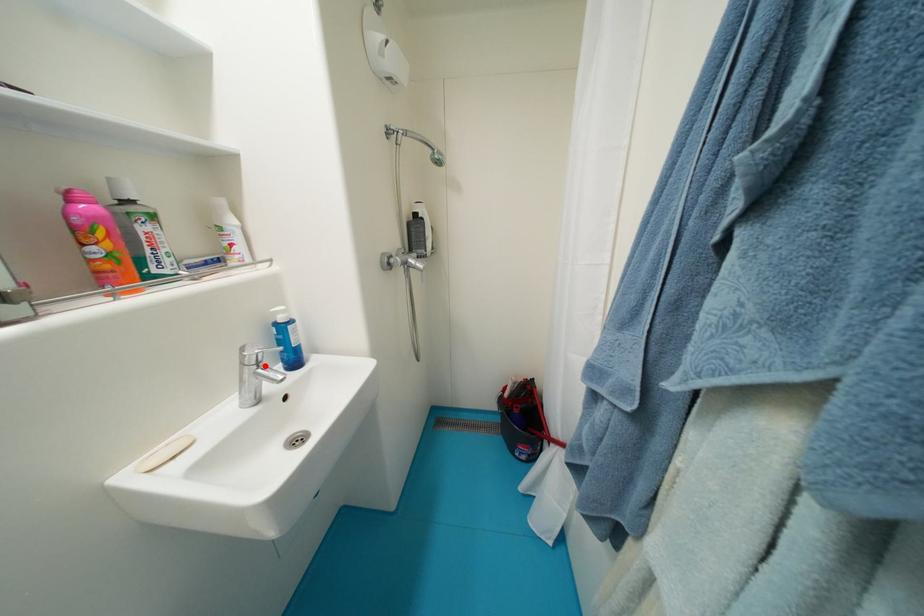
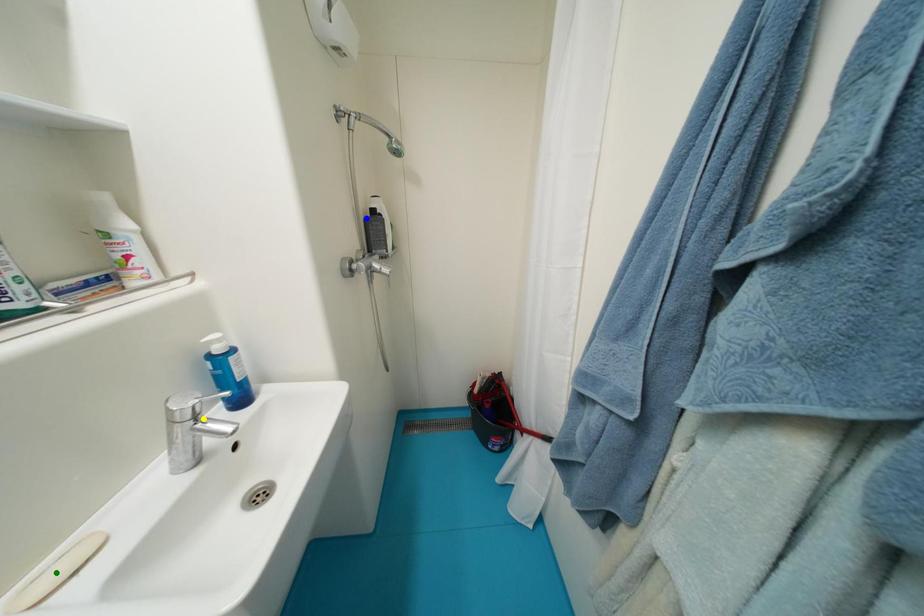
Question: I am providing you with two images of the same scene from different viewpoints. A red point is marked on the first image. You are given multiple points on the second image. Which point in image 2 is actually the same real-world point as the red point in image 1?

Choices:
 (A) green point
 (B) yellow point
 (C) blue point

Answer: (B)